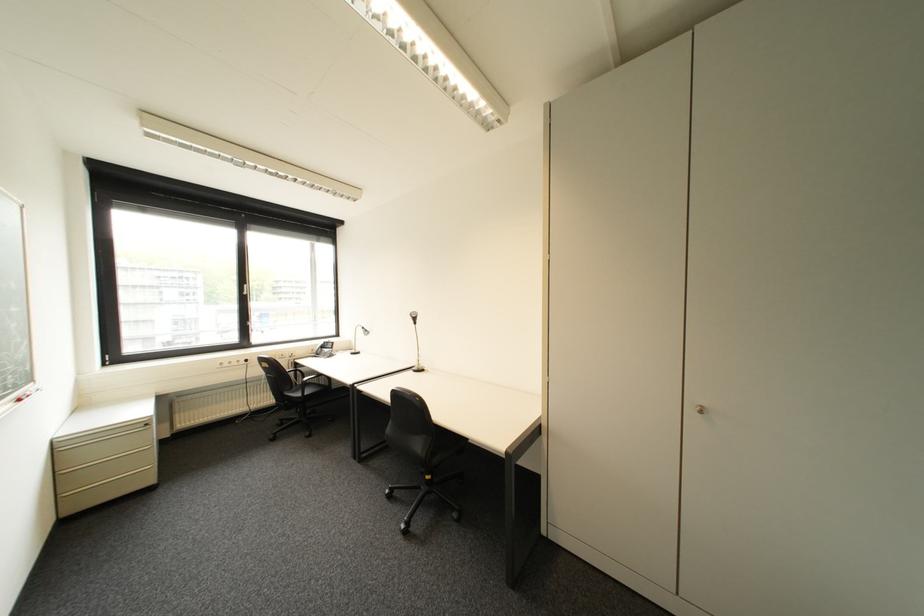
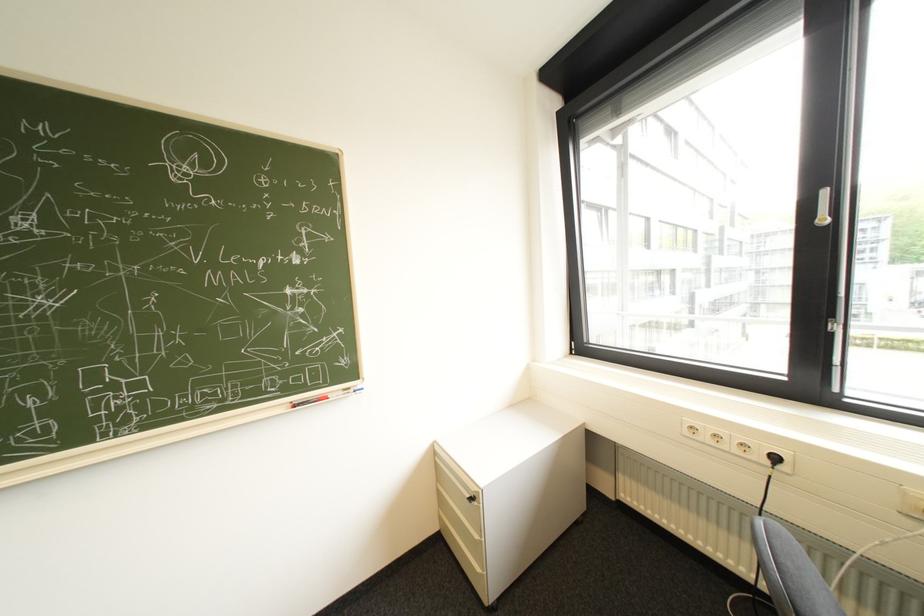
In the second image, find the point that corresponds to the point at 256,286 in the first image.

(834, 193)